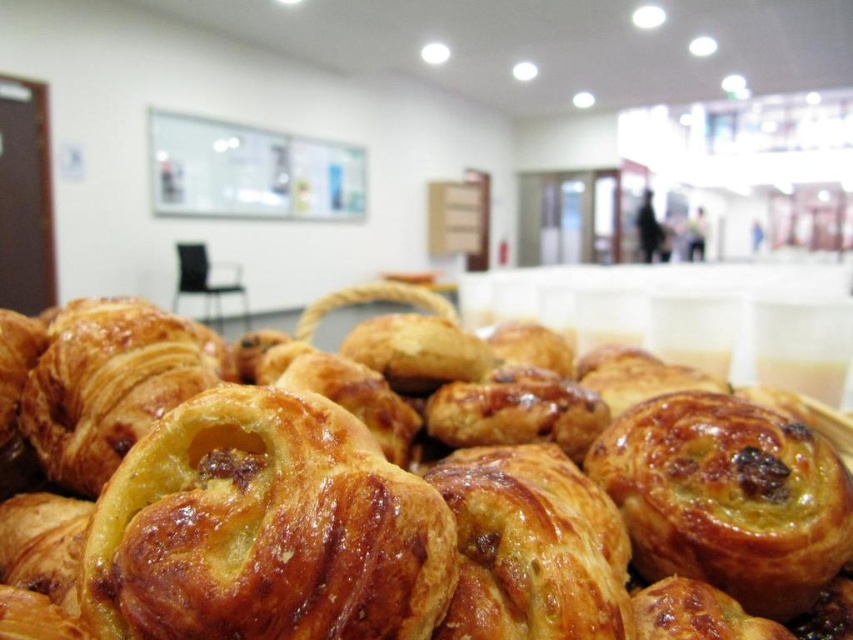
Measure the distance from golden brown flaky pastry at center to golden-brown flaky pastry at center.

golden brown flaky pastry at center and golden-brown flaky pastry at center are 31.49 centimeters apart from each other.

Is golden brown flaky pastry at center wider than golden-brown flaky pastry at center?

Correct, the width of golden brown flaky pastry at center exceeds that of golden-brown flaky pastry at center.

Between point (621, 605) and point (401, 547), which one is positioned in front?

Point (401, 547) is more forward.

You are a GUI agent. You are given a task and a screenshot of the screen. Output one action in this format:
    pyautogui.click(x=<x>, y=<y>)
    Task: Click on the golden brown flaky pastry at center
    The image size is (853, 640).
    Given the screenshot: What is the action you would take?
    pyautogui.click(x=399, y=486)